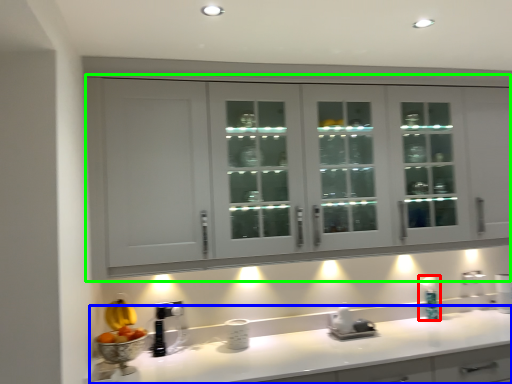
Question: Which is farther away from soap dispenser (highlighted by a red box)? countertop (highlighted by a blue box) or cabinetry (highlighted by a green box)?

Choices:
 (A) countertop
 (B) cabinetry

Answer: (B)